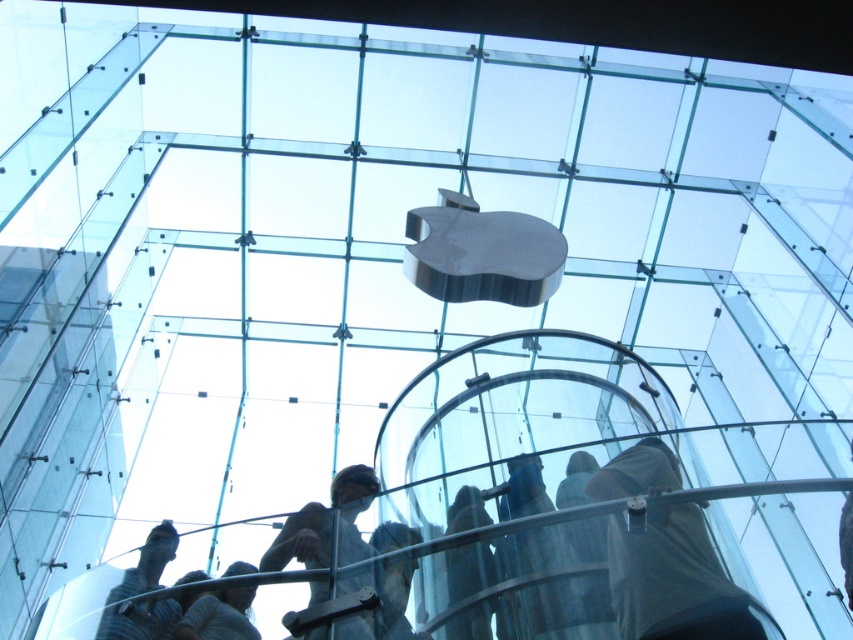
Is gray fabric shirt at lower right shorter than striped fabric shirt at lower left?

No, gray fabric shirt at lower right is not shorter than striped fabric shirt at lower left.

Describe the element at coordinates (675, 580) in the screenshot. The height and width of the screenshot is (640, 853). I see `gray fabric shirt at lower right` at that location.

Find the location of `gray fabric shirt at lower right`. gray fabric shirt at lower right is located at coordinates (675, 580).

Is point (166, 632) positioned behind point (227, 632)?

Yes.

Looking at this image, does striped fabric shirt at lower left appear on the left side of gray fabric shirt at lower center?

Correct, you'll find striped fabric shirt at lower left to the left of gray fabric shirt at lower center.

Is point (132, 579) closer to viewer compared to point (183, 637)?

No, it is not.

Image resolution: width=853 pixels, height=640 pixels. Find the location of `striped fabric shirt at lower left`. striped fabric shirt at lower left is located at coordinates (148, 563).

Locate an element on the screen. The height and width of the screenshot is (640, 853). metallic statue at center is located at coordinates (326, 525).

Does metallic statue at center appear on the right side of gray fabric shirt at lower center?

Indeed, metallic statue at center is positioned on the right side of gray fabric shirt at lower center.

Which is in front, point (367, 582) or point (193, 605)?

Positioned in front is point (367, 582).

This screenshot has height=640, width=853. In order to click on metallic statue at center in this screenshot , I will do `click(326, 525)`.